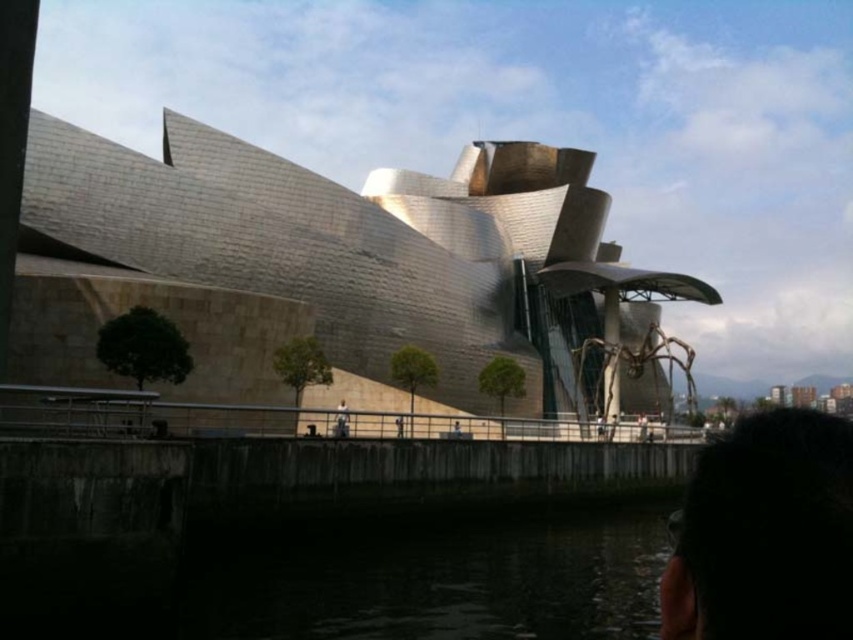
You are standing in the plaza in front of the metallic silver building at center. You want to take a photo of the building without any obstructions. Is the dark hair at lower right blocking your view of the building?

The metallic silver building at center is above the dark hair at lower right, so the dark hair at lower right is not blocking the view of the building.

You are standing in front of the museum and want to take a photo of the dark hair at center and dark water at lower center. Which object should you focus on first if you want both to be in the same frame?

You should focus on the dark hair at center first because it is closer to you than the dark water at lower center, which is further away.